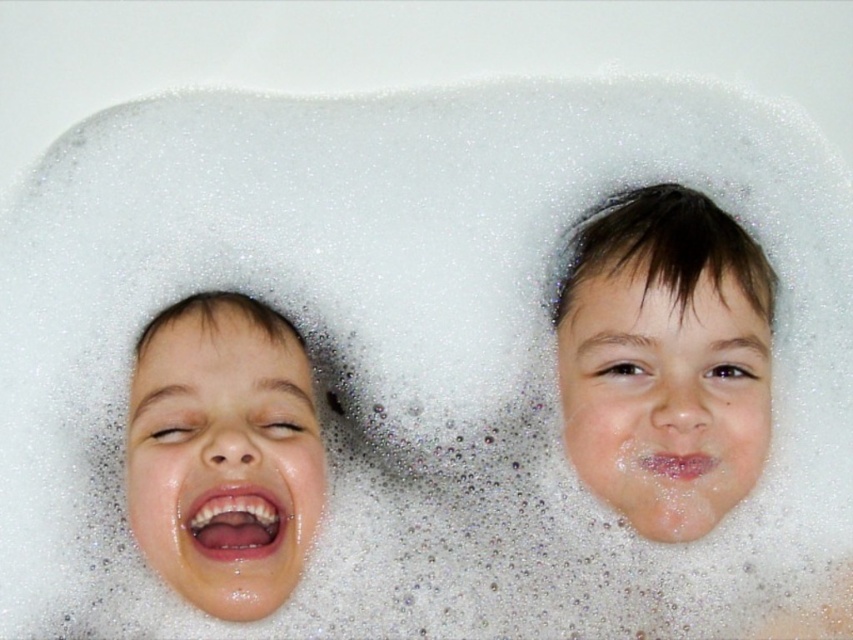
Question: Among these points, which one is nearest to the camera?

Choices:
 (A) (656, 195)
 (B) (291, 440)

Answer: (B)

Question: Can you confirm if smooth skin face at upper center is positioned above smooth skin face at left?

Choices:
 (A) no
 (B) yes

Answer: (B)

Question: Which point appears farthest from the camera in this image?

Choices:
 (A) (219, 316)
 (B) (699, 396)

Answer: (A)

Question: Is smooth skin face at upper center positioned behind smooth skin face at left?

Choices:
 (A) no
 (B) yes

Answer: (B)

Question: Is smooth skin face at upper center bigger than smooth skin face at left?

Choices:
 (A) yes
 (B) no

Answer: (A)

Question: Which point appears farthest from the camera in this image?

Choices:
 (A) (167, 548)
 (B) (572, 307)

Answer: (B)